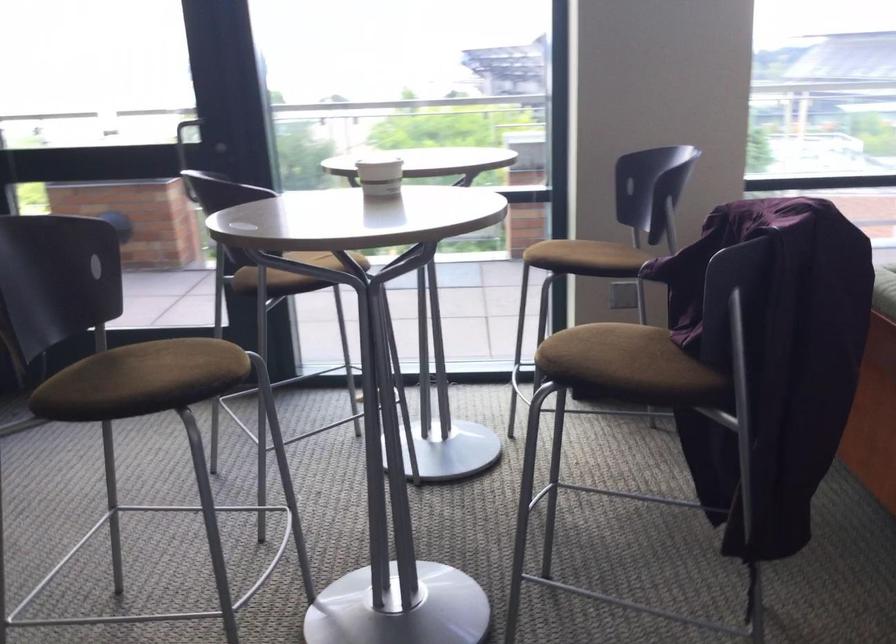
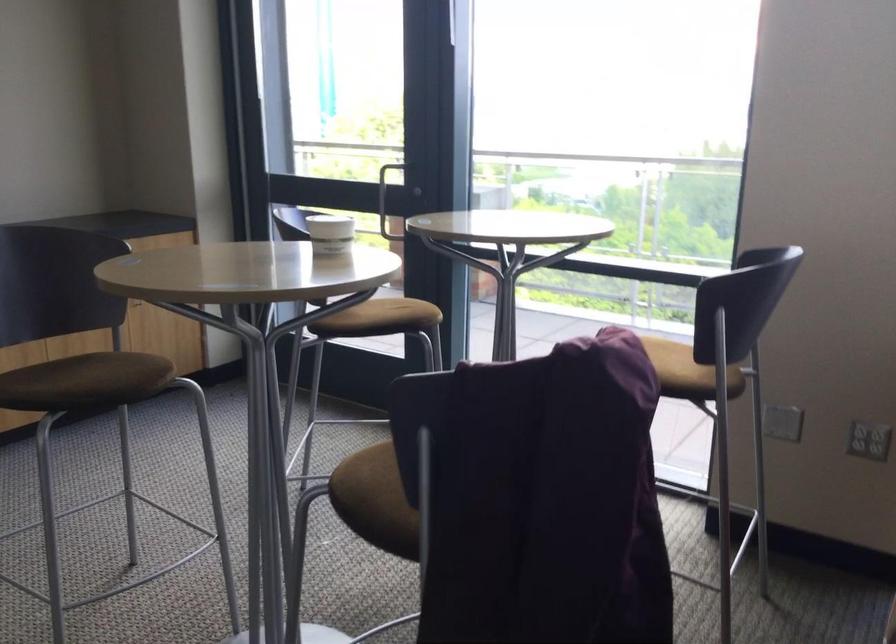
In the second image, find the point that corresponds to (622,383) in the first image.

(369, 500)